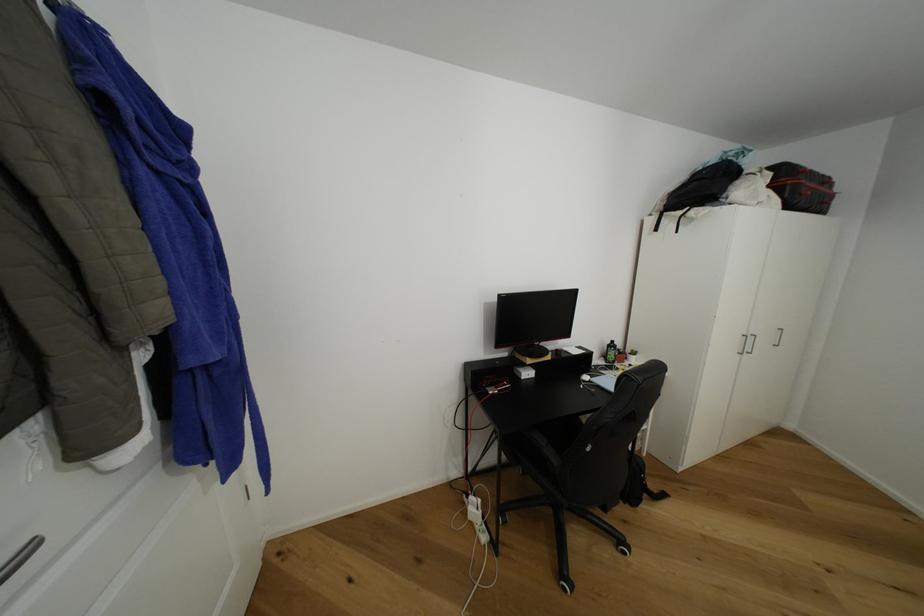
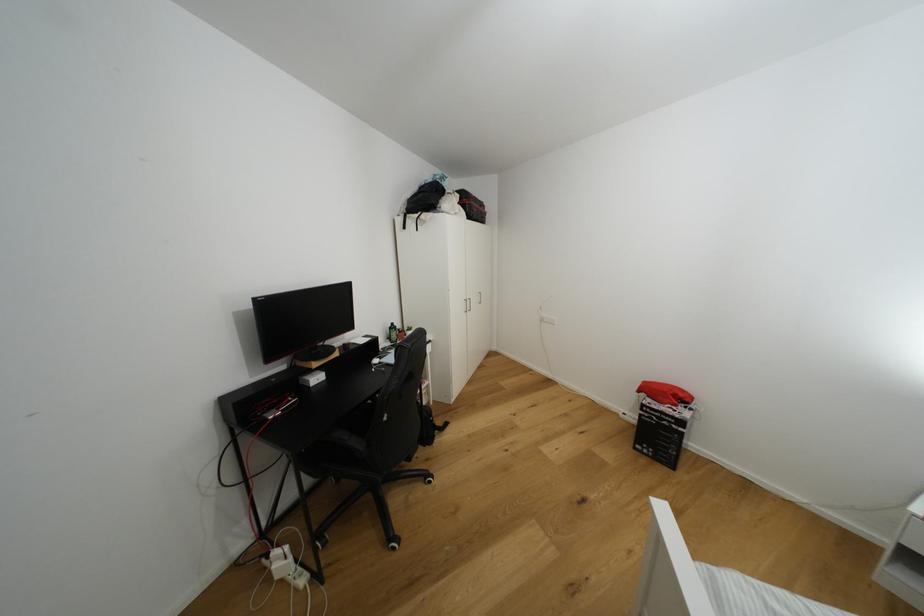
In the second image, find the point that corresponds to point 658,488 in the first image.

(444, 424)